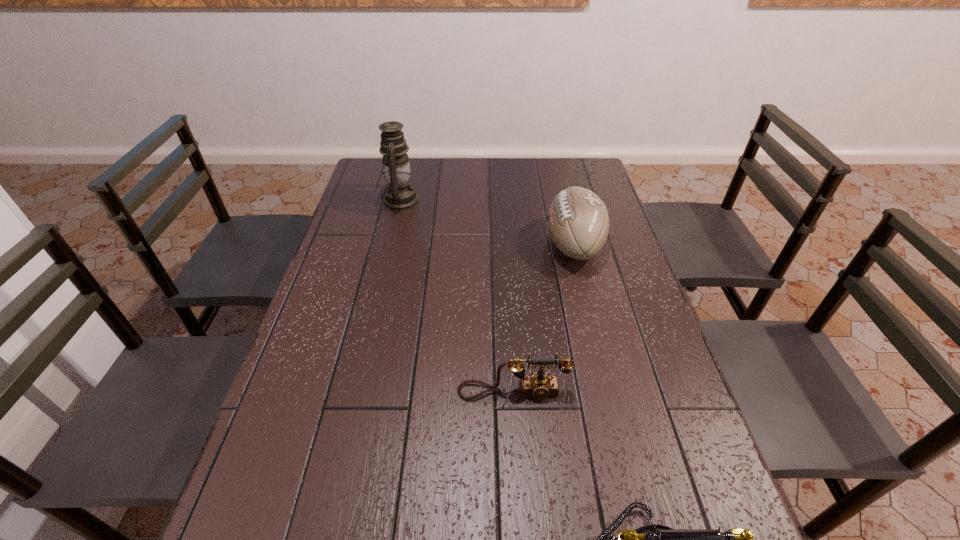
Locate an element on the screen. The width and height of the screenshot is (960, 540). free space that is in between the farther telephone and the third nearest object is located at coordinates (543, 319).

Identify the location of vacant area that lies between the oil lamp and the third nearest object. The width and height of the screenshot is (960, 540). (487, 223).

The image size is (960, 540). Identify the location of free space between the leftmost object and the second farthest object. (487, 223).

Image resolution: width=960 pixels, height=540 pixels. Identify the location of free space between the third nearest object and the shorter telephone. (543, 319).

Identify the location of vacant area that lies between the shorter telephone and the football (American). (543, 319).

At what (x,y) coordinates should I click in order to perform the action: click on object that is the second closest one to the farthest object. Please return your answer as a coordinate pair (x, y). Looking at the image, I should click on click(540, 386).

Where is `object that stands as the second closest to the taller telephone`? object that stands as the second closest to the taller telephone is located at coordinates (578, 222).

Where is `blank space that satisfies the following two spatial constraints: 1. on the laces of the football (American); 2. on the front-facing side of the third farthest object`? blank space that satisfies the following two spatial constraints: 1. on the laces of the football (American); 2. on the front-facing side of the third farthest object is located at coordinates (610, 392).

Locate an element on the screen. vacant region that satisfies the following two spatial constraints: 1. on the laces of the third nearest object; 2. on the front-facing side of the third farthest object is located at coordinates (610, 392).